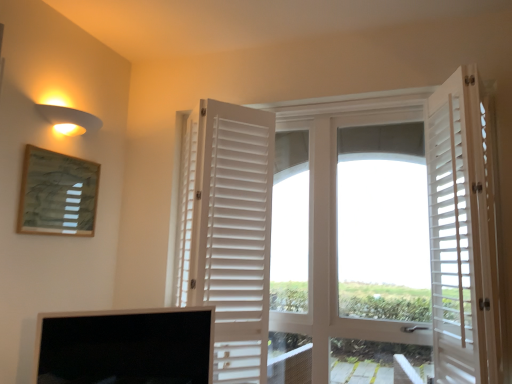
Question: Are white wooden door at center, arranged as the 2th door when viewed from the right, and black glossy screen at lower left located far from each other?

Choices:
 (A) yes
 (B) no

Answer: (B)

Question: Considering the relative sizes of white wooden door at center, marked as the 2th door in a left-to-right arrangement, and black glossy screen at lower left in the image provided, is white wooden door at center, marked as the 2th door in a left-to-right arrangement, shorter than black glossy screen at lower left?

Choices:
 (A) no
 (B) yes

Answer: (A)

Question: Are white wooden door at center, arranged as the 2th door when viewed from the right, and black glossy screen at lower left making contact?

Choices:
 (A) yes
 (B) no

Answer: (B)

Question: Can you confirm if white wooden door at center, arranged as the 2th door when viewed from the right, is smaller than black glossy screen at lower left?

Choices:
 (A) no
 (B) yes

Answer: (A)

Question: Is white wooden door at center, arranged as the 2th door when viewed from the right, thinner than black glossy screen at lower left?

Choices:
 (A) yes
 (B) no

Answer: (B)

Question: From the image's perspective, is white wooden door at center, marked as the 2th door in a left-to-right arrangement, below black glossy screen at lower left?

Choices:
 (A) no
 (B) yes

Answer: (A)

Question: Considering the relative sizes of white matte shutters at center, which is counted as the 1th door, starting from the left, and matte yellow wall sconce at upper left in the image provided, is white matte shutters at center, which is counted as the 1th door, starting from the left, wider than matte yellow wall sconce at upper left?

Choices:
 (A) no
 (B) yes

Answer: (B)

Question: Does white matte shutters at center, which is counted as the 1th door, starting from the left, have a lesser width compared to matte yellow wall sconce at upper left?

Choices:
 (A) no
 (B) yes

Answer: (A)

Question: Is white matte shutters at center, which is counted as the 1th door, starting from the left, facing away from matte yellow wall sconce at upper left?

Choices:
 (A) no
 (B) yes

Answer: (A)

Question: From a real-world perspective, is white matte shutters at center, the 3th door positioned from the right, below matte yellow wall sconce at upper left?

Choices:
 (A) yes
 (B) no

Answer: (A)

Question: Is white matte shutters at center, which is counted as the 1th door, starting from the left, to the right of matte yellow wall sconce at upper left from the viewer's perspective?

Choices:
 (A) no
 (B) yes

Answer: (B)

Question: Is white matte shutters at center, which is counted as the 1th door, starting from the left, not inside matte yellow wall sconce at upper left?

Choices:
 (A) no
 (B) yes

Answer: (B)

Question: From the image's perspective, is wooden textured picture frame at upper left under white wooden shutters at right, positioned as the first door in right-to-left order?

Choices:
 (A) yes
 (B) no

Answer: (B)